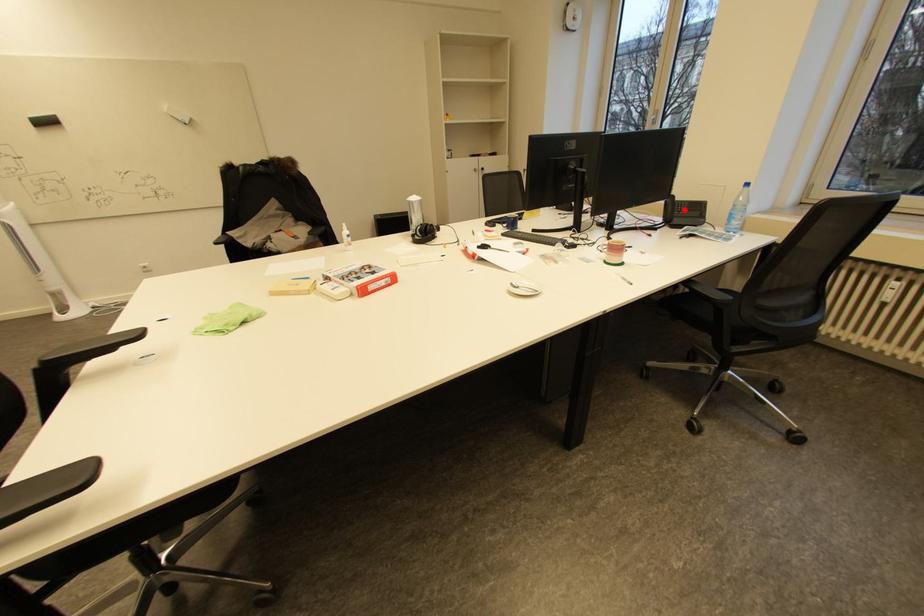
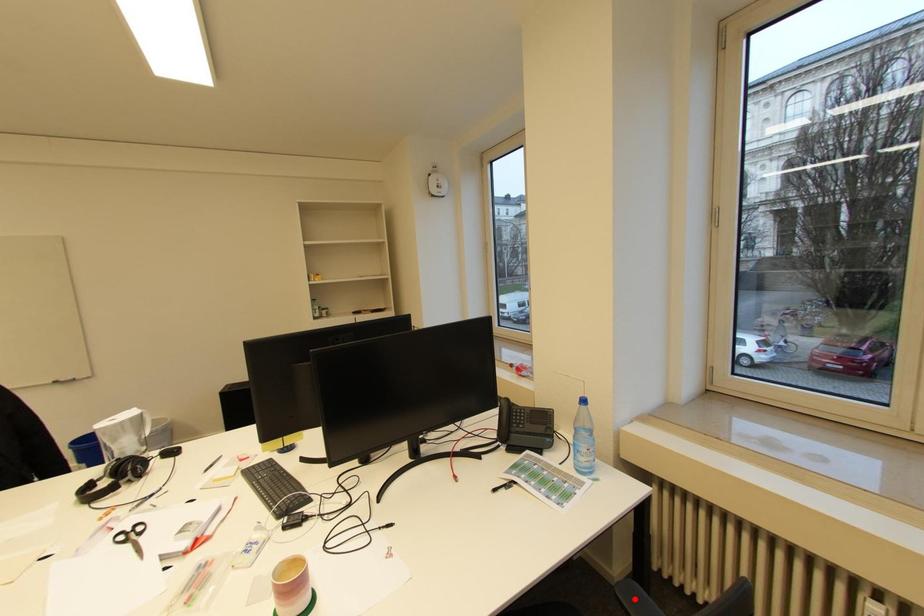
I am providing you with two images of the same scene from different viewpoints. A red point is marked on the first image and another point is marked on the second image. Are the points marked in image1 and image2 representing the same 3D position?

No